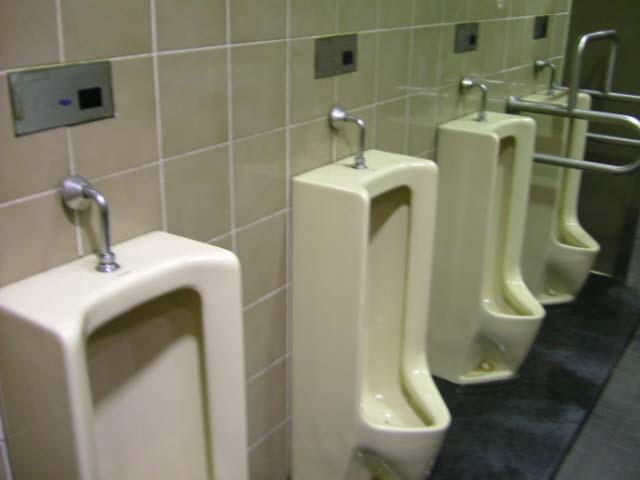
Identify the location of urinal. The height and width of the screenshot is (480, 640). (92, 295), (319, 215), (482, 124), (562, 108).